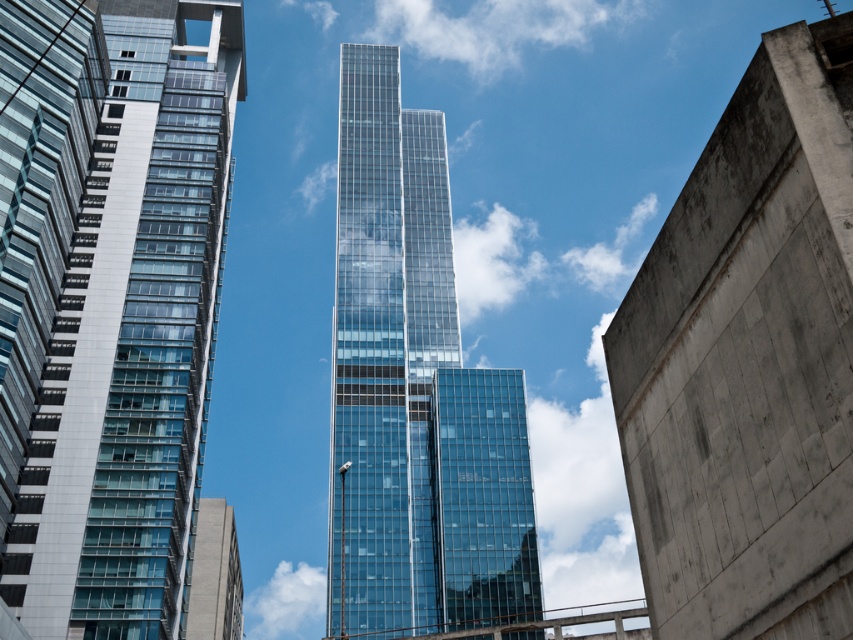
Question: Is the position of transparent glass tower at center more distant than that of gray concrete building at lower left?

Choices:
 (A) yes
 (B) no

Answer: (B)

Question: Which object is the farthest from the transparent glass building at center?

Choices:
 (A) gray concrete building at lower left
 (B) smooth concrete wall at right
 (C) glassy blue skyscraper at left
 (D) transparent glass tower at center

Answer: (B)

Question: Is smooth concrete wall at right closer to the viewer compared to transparent glass building at center?

Choices:
 (A) yes
 (B) no

Answer: (A)

Question: Estimate the real-world distances between objects in this image. Which object is farther from the transparent glass building at center?

Choices:
 (A) gray concrete building at lower left
 (B) glassy blue skyscraper at left
 (C) smooth concrete wall at right
 (D) transparent glass tower at center

Answer: (C)

Question: Where is smooth concrete wall at right located in relation to transparent glass tower at center in the image?

Choices:
 (A) below
 (B) above

Answer: (A)

Question: Which object is the farthest from the transparent glass tower at center?

Choices:
 (A) gray concrete building at lower left
 (B) transparent glass building at center

Answer: (A)